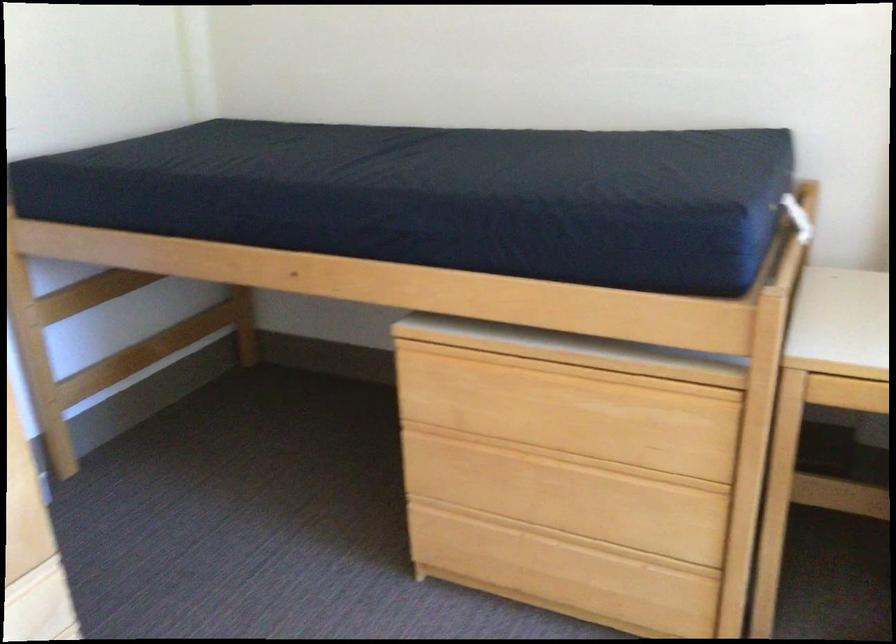
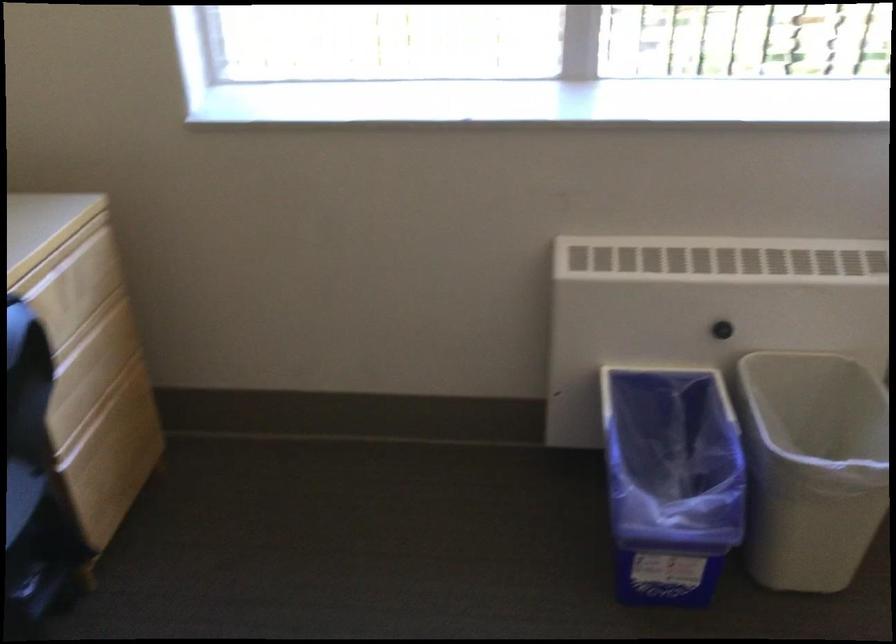
Based on the continuous images, in which direction is the camera rotating?

The camera's rotation is toward right-down.